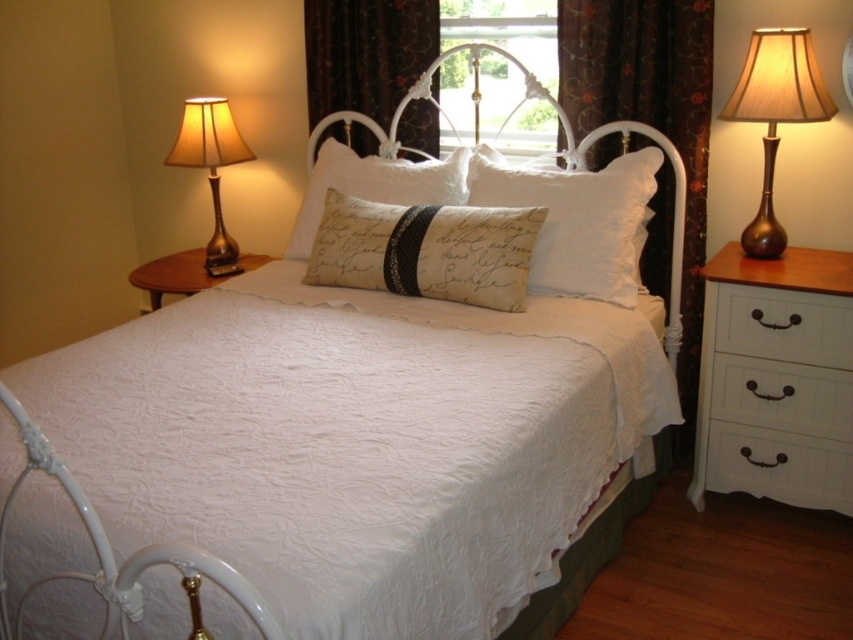
You are standing at the foot of the bed and want to reach the dark floral fabric curtain at upper center. However, there is a white textured pillow at center in the way. Can you move around it to the left to reach the curtain?

The white textured pillow at center is to the right of the dark floral fabric curtain at upper center, so you can move around it to the left to reach the curtain.

You are standing in the bedroom and want to reach both the beige fabric pillow with script at center and the dark floral fabric curtain at upper center. Which object will you need to move closer to first?

The beige fabric pillow with script at center is closer to the viewer than the dark floral fabric curtain at upper center, so you will need to move closer to the beige fabric pillow with script at center first.